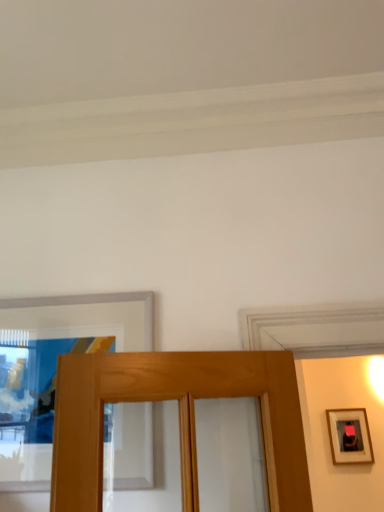
Question: In the image, is wooden picture frame at upper left, the 1th picture frame from the top, on the left side or the right side of wooden framed mirror at right, which appears as the second picture frame when viewed from the top?

Choices:
 (A) left
 (B) right

Answer: (A)

Question: Is wooden picture frame at upper left, the first picture frame positioned from the front, taller or shorter than wooden framed mirror at right, acting as the 1th picture frame starting from the bottom?

Choices:
 (A) short
 (B) tall

Answer: (B)

Question: In terms of width, does wooden picture frame at upper left, the 2th picture frame from the bottom, look wider or thinner when compared to wooden framed mirror at right, which is counted as the 1th picture frame, starting from the right?

Choices:
 (A) wide
 (B) thin

Answer: (A)

Question: Is wooden framed mirror at right, acting as the 1th picture frame starting from the bottom, in front of or behind wooden picture frame at upper left, which is the 1th picture frame from left to right, in the image?

Choices:
 (A) front
 (B) behind

Answer: (B)

Question: Looking at their shapes, would you say wooden framed mirror at right, which appears as the second picture frame when viewed from the top, is wider or thinner than wooden picture frame at upper left, the first picture frame positioned from the front?

Choices:
 (A) wide
 (B) thin

Answer: (B)

Question: From a real-world perspective, relative to wooden picture frame at upper left, the 1th picture frame from the top, is wooden framed mirror at right, placed as the 2th picture frame when sorted from left to right, vertically above or below?

Choices:
 (A) below
 (B) above

Answer: (A)

Question: Is wooden framed mirror at right, the 2th picture frame viewed from the front, bigger or smaller than wooden picture frame at upper left, which appears as the 2th picture frame when viewed from the back?

Choices:
 (A) big
 (B) small

Answer: (B)